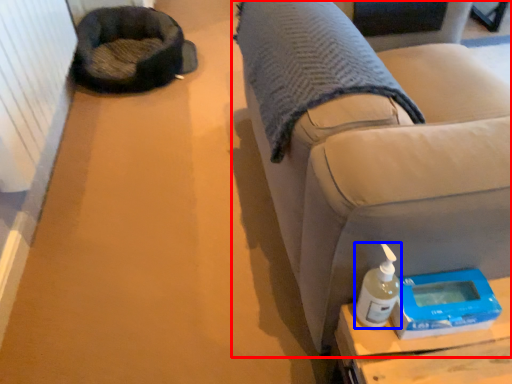
Question: Which of the following is the farthest to the observer, furniture (highlighted by a red box) or bottle (highlighted by a blue box)?

Choices:
 (A) furniture
 (B) bottle

Answer: (B)